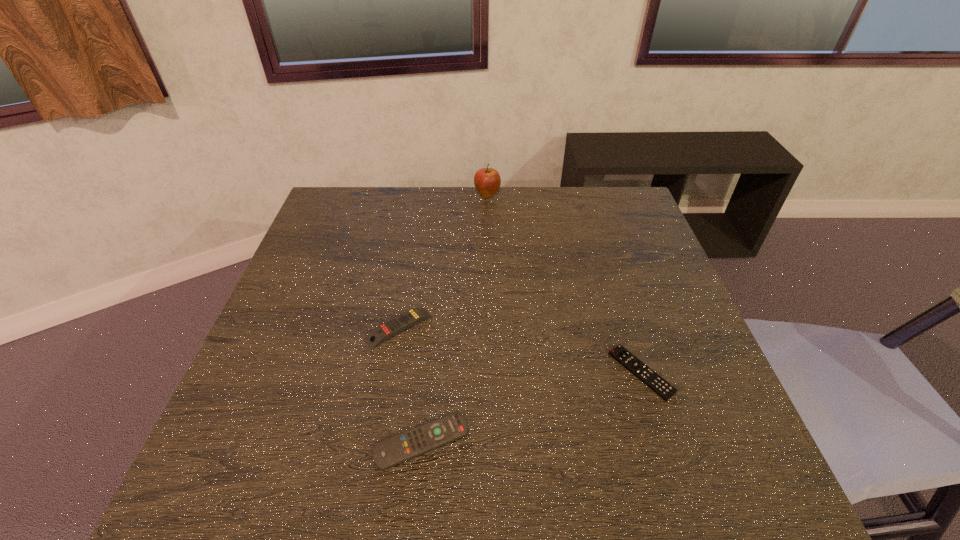
Locate an element on the screen. This screenshot has height=540, width=960. object that is the second closest one to the nearest remote control is located at coordinates (660, 386).

Locate which remote control is the second closest to the shortest remote control. Please provide its 2D coordinates. Your answer should be formatted as a tuple, i.e. [(x, y)], where the tuple contains the x and y coordinates of a point satisfying the conditions above.

[(390, 328)]

Identify the location of remote control object that ranks as the third closest to the apple. (392, 451).

Locate an element on the screen. vacant region that satisfies the following two spatial constraints: 1. on the back side of the shortest object; 2. on the left side of the nearest remote control is located at coordinates (428, 372).

Where is `blank space that satisfies the following two spatial constraints: 1. on the back side of the nearest remote control; 2. on the right side of the apple`? The image size is (960, 540). blank space that satisfies the following two spatial constraints: 1. on the back side of the nearest remote control; 2. on the right side of the apple is located at coordinates (446, 195).

This screenshot has width=960, height=540. I want to click on vacant position in the image that satisfies the following two spatial constraints: 1. on the front side of the rightmost remote control; 2. on the right side of the apple, so click(x=491, y=372).